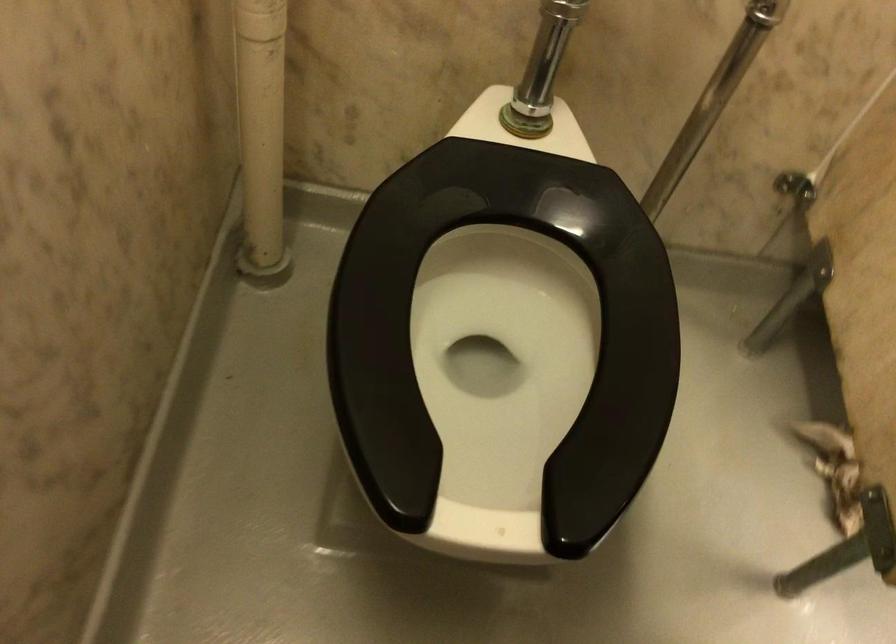
Find the location of `black toilet seat`. black toilet seat is located at coordinates (504, 332).